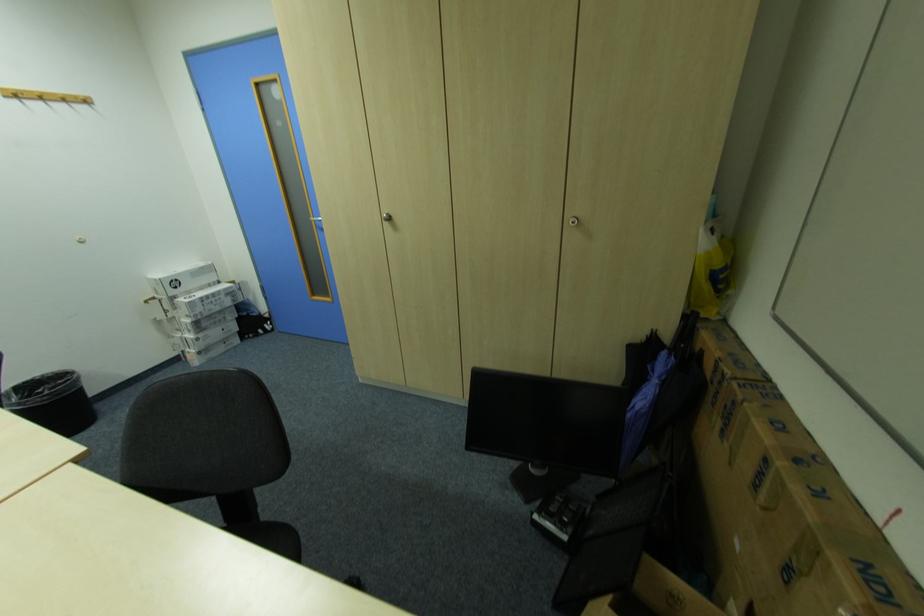
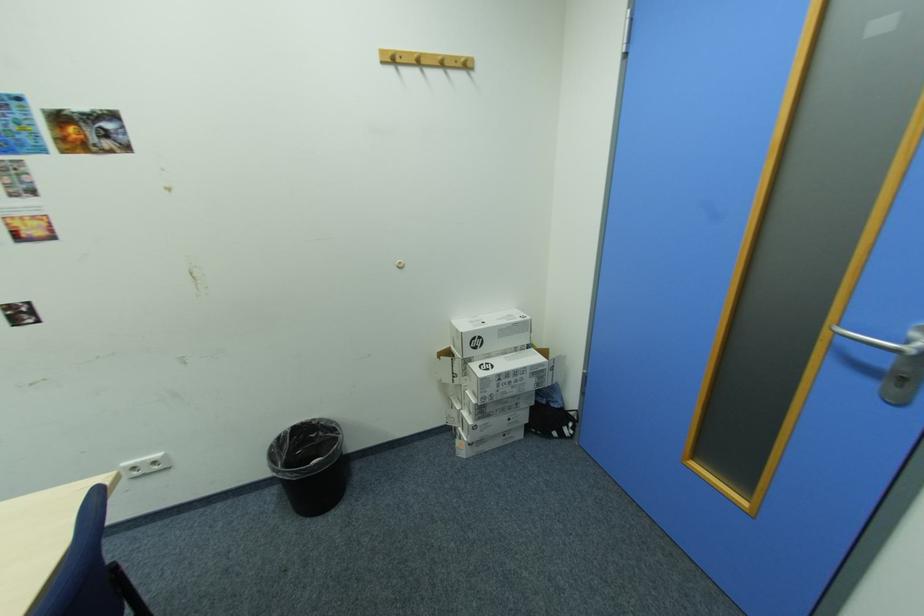
The point at (197, 322) is marked in the first image. Where is the corresponding point in the second image?

(481, 400)